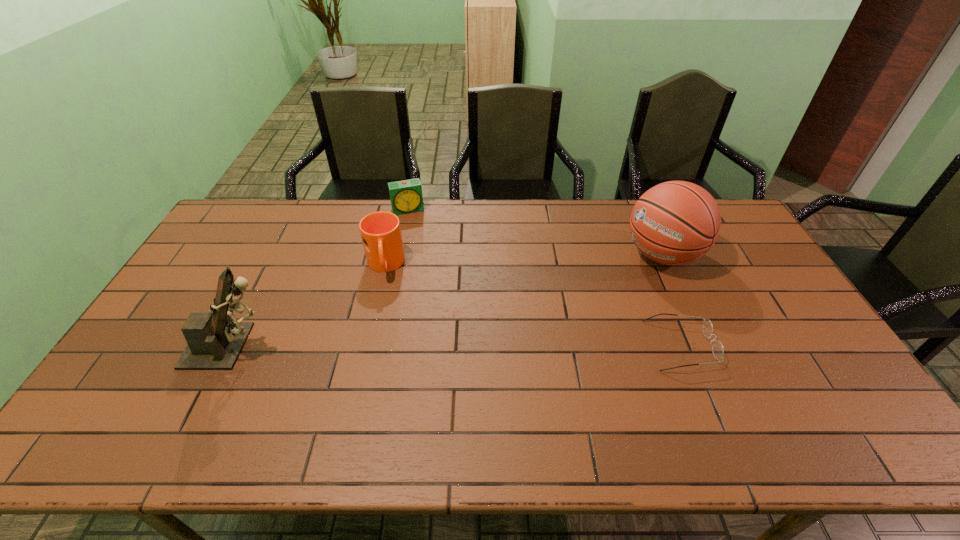
Image resolution: width=960 pixels, height=540 pixels. I want to click on free spot on the desktop that is between the leftmost object and the spectacles and is positioned on the handle side of the third tallest object, so click(x=394, y=346).

Locate an element on the screen. vacant space on the desktop that is between the leftmost object and the spectacles and is positioned on the logo side of the basketball is located at coordinates (521, 346).

At what (x,y) coordinates should I click in order to perform the action: click on vacant space on the desktop that is between the figurine and the shortest object and is positioned on the front-facing side of the alarm clock. Please return your answer as a coordinate pair (x, y). The width and height of the screenshot is (960, 540). Looking at the image, I should click on (450, 346).